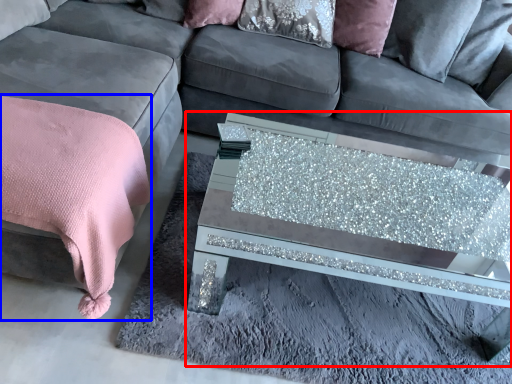
Question: Which object is closer to the camera taking this photo, coffee table (highlighted by a red box) or blanket (highlighted by a blue box)?

Choices:
 (A) coffee table
 (B) blanket

Answer: (B)